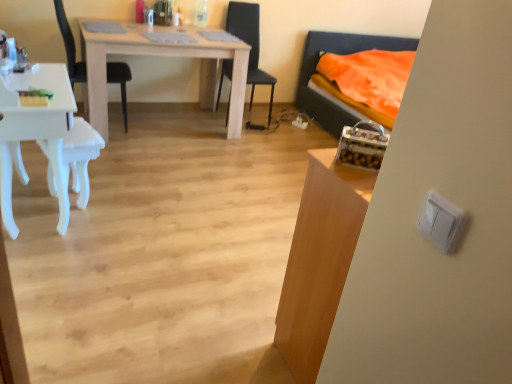
Where is `free space to the back side of white glossy armchair at lower left`? free space to the back side of white glossy armchair at lower left is located at coordinates (109, 180).